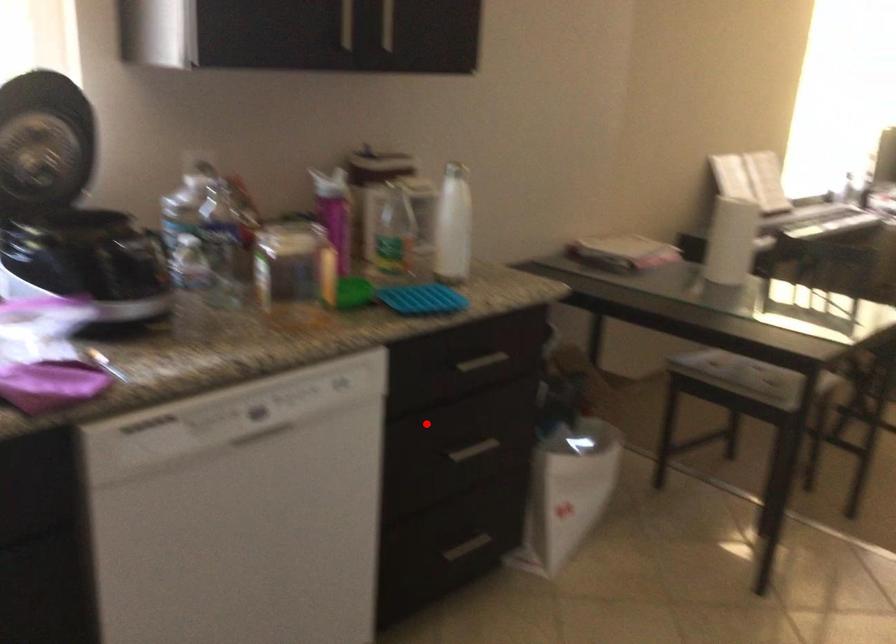
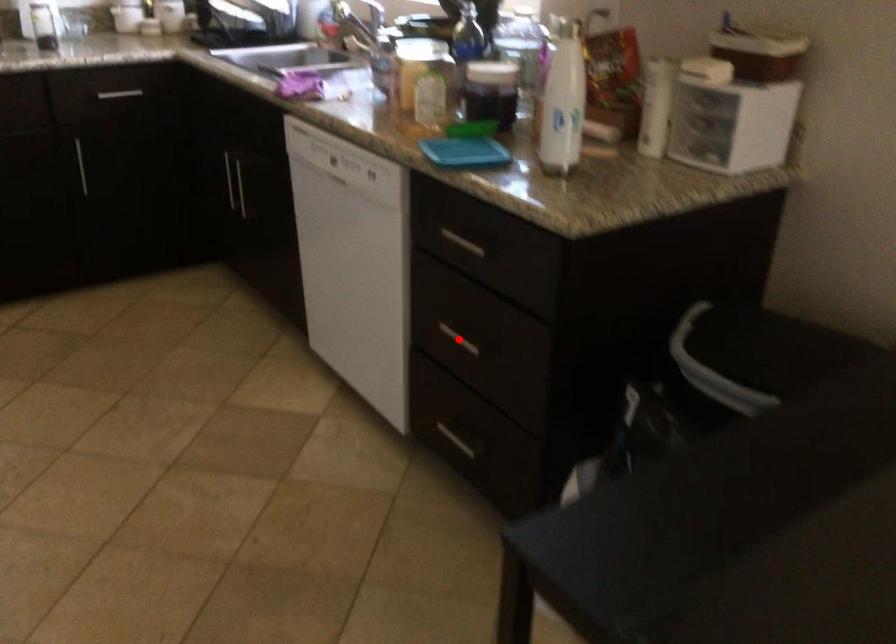
I am providing you with two images of the same scene from different viewpoints. A red point is marked on the first image and another point is marked on the second image. Is the marked point in image1 the same physical position as the marked point in image2?

Yes